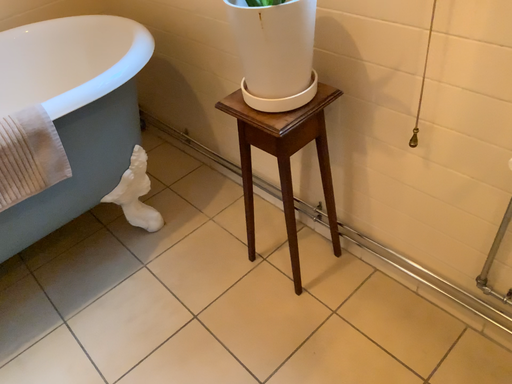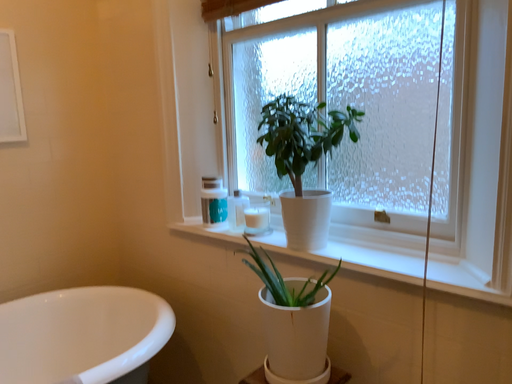
Question: Which way did the camera rotate in the video?

Choices:
 (A) rotated upward
 (B) rotated downward

Answer: (A)